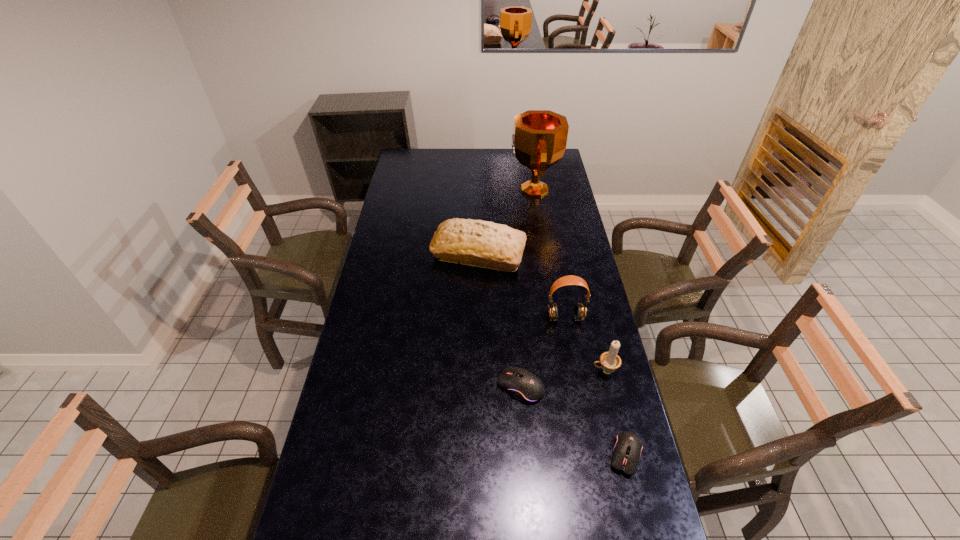
You are a GUI agent. You are given a task and a screenshot of the screen. Output one action in this format:
    pyautogui.click(x=<x>, y=<y>)
    Task: Click on the third closest object relative to the award
    
    Given the screenshot: What is the action you would take?
    pyautogui.click(x=610, y=361)

You are a GUI agent. You are given a task and a screenshot of the screen. Output one action in this format:
    pyautogui.click(x=<x>, y=<y>)
    Task: Click on the vacant position in the image that satisfies the following two spatial constraints: 1. on the handle side of the candle_holder; 2. on the back side of the nearest object
    
    Given the screenshot: What is the action you would take?
    pyautogui.click(x=625, y=455)

Locate an element on the screen. vacant space that satisfies the following two spatial constraints: 1. on the front side of the fifth nearest object; 2. on the right side of the taller computer mouse is located at coordinates (478, 387).

Find the location of a particular element. The image size is (960, 540). free spot that satisfies the following two spatial constraints: 1. on the back side of the shorter computer mouse; 2. on the side of the award with the star emblem is located at coordinates (562, 190).